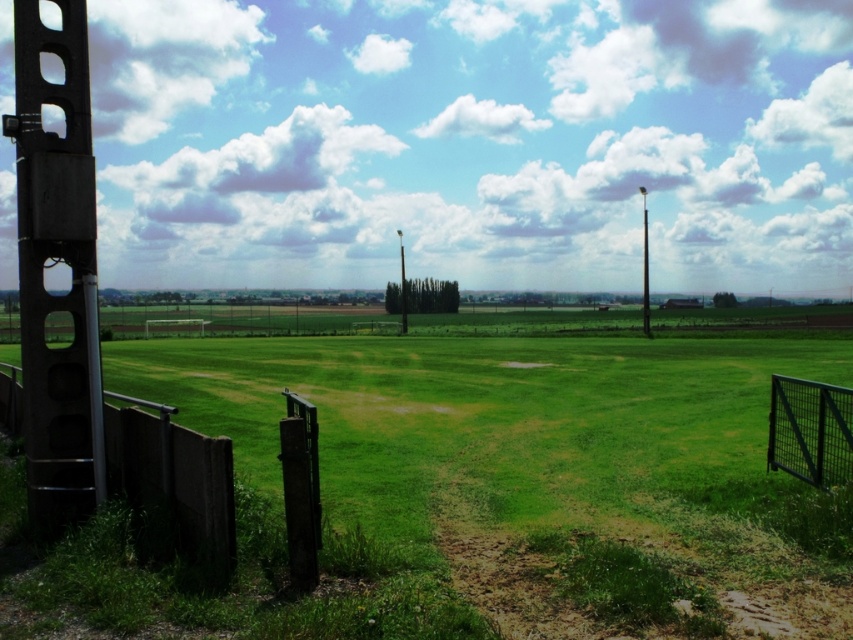
Between green grass at center and dark gray concrete fence at lower left, which one is positioned higher?

Positioned higher is dark gray concrete fence at lower left.

Does green grass at center appear under dark gray concrete fence at lower left?

Yes, green grass at center is below dark gray concrete fence at lower left.

This screenshot has width=853, height=640. What do you see at coordinates (535, 454) in the screenshot? I see `green grass at center` at bounding box center [535, 454].

Where is `green grass at center`? green grass at center is located at coordinates (535, 454).

Is green grass at center bigger than smooth metal pole at right?

No, green grass at center is not bigger than smooth metal pole at right.

Between green grass at center and smooth metal pole at right, which one has more height?

smooth metal pole at right is taller.

Who is more forward, (x=543, y=417) or (x=643, y=330)?

Point (x=543, y=417) is in front.

This screenshot has height=640, width=853. Identify the location of green grass at center. (535, 454).

Which is above, green grass at center or black wire mesh fence at right?

Positioned higher is black wire mesh fence at right.

Does green grass at center have a greater width compared to black wire mesh fence at right?

Yes.

Image resolution: width=853 pixels, height=640 pixels. Find the location of `green grass at center`. green grass at center is located at coordinates (535, 454).